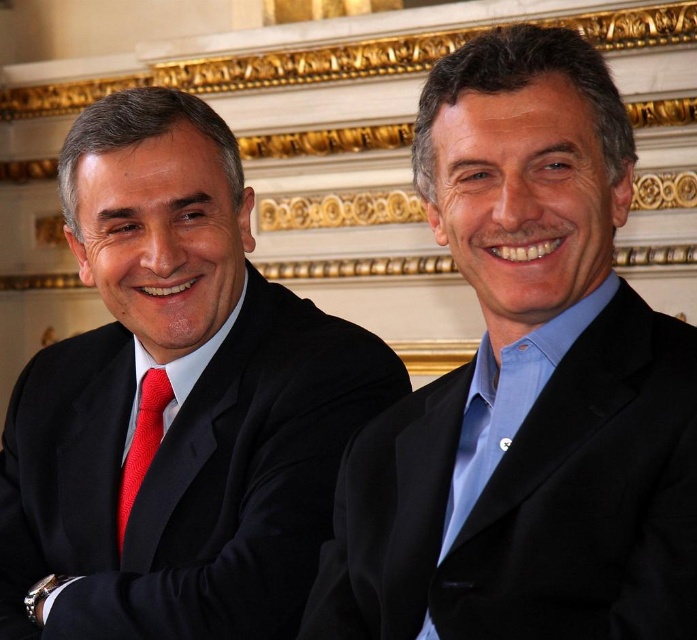
Is blue satin suit at right closer to the viewer compared to matte black suit at left?

Yes, it is in front of matte black suit at left.

This screenshot has height=640, width=697. I want to click on blue satin suit at right, so click(526, 387).

Does matte black suit at left appear under knitted red tie at left?

Incorrect, matte black suit at left is not positioned below knitted red tie at left.

Which is below, matte black suit at left or knitted red tie at left?

knitted red tie at left

The image size is (697, 640). What do you see at coordinates (174, 403) in the screenshot? I see `matte black suit at left` at bounding box center [174, 403].

In order to click on matte black suit at left in this screenshot , I will do 174,403.

Is point (597, 454) positioned in front of point (139, 465)?

That is True.

Can you confirm if blue satin suit at right is positioned to the left of knitted red tie at left?

No, blue satin suit at right is not to the left of knitted red tie at left.

Who is more forward, [549,280] or [146,449]?

Positioned in front is point [549,280].

Find the location of `blue satin suit at right`. blue satin suit at right is located at coordinates (526, 387).